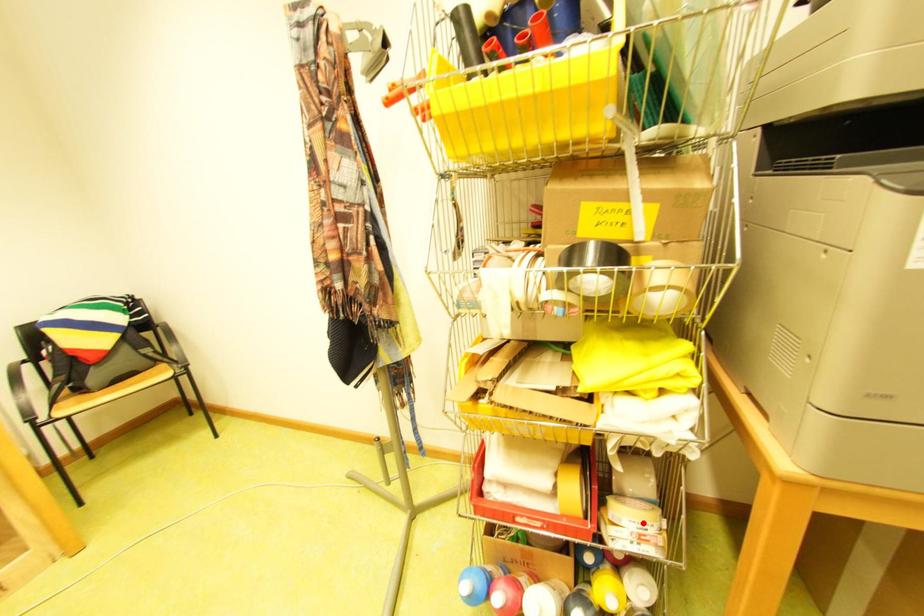
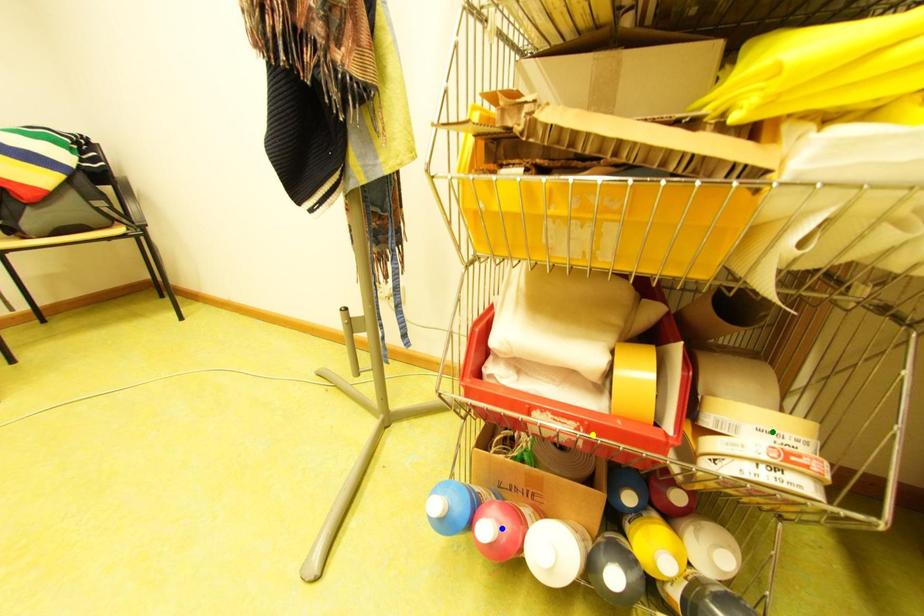
Question: I am providing you with two images of the same scene from different viewpoints. A red point is marked on the first image. You are given multiple points on the second image. In image 2, which mark is for the same physical point as the one in image 1?

Choices:
 (A) green point
 (B) blue point
 (C) yellow point

Answer: (A)